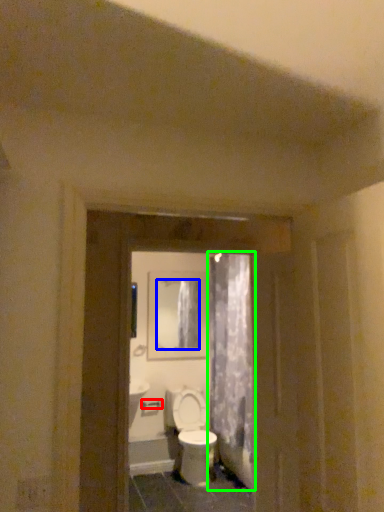
Question: Estimate the real-world distances between objects in this image. Which object is farther from door handle (highlighted by a red box), mirror (highlighted by a blue box) or shower curtain (highlighted by a green box)?

Choices:
 (A) mirror
 (B) shower curtain

Answer: (B)